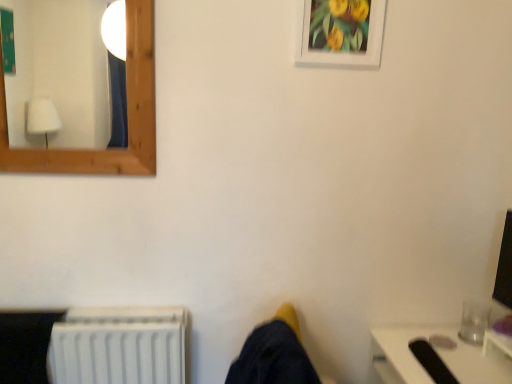
Question: From the image's perspective, is white matte picture frame at upper center below wooden frame mirror at upper left?

Choices:
 (A) yes
 (B) no

Answer: (B)

Question: Is white matte picture frame at upper center positioned with its back to wooden frame mirror at upper left?

Choices:
 (A) yes
 (B) no

Answer: (B)

Question: Can you confirm if white matte picture frame at upper center is taller than wooden frame mirror at upper left?

Choices:
 (A) no
 (B) yes

Answer: (A)

Question: Are white matte picture frame at upper center and wooden frame mirror at upper left beside each other?

Choices:
 (A) no
 (B) yes

Answer: (A)

Question: Is white matte picture frame at upper center oriented towards wooden frame mirror at upper left?

Choices:
 (A) yes
 (B) no

Answer: (B)

Question: Based on their sizes in the image, would you say white plastic radiator at lower left is bigger or smaller than wooden frame mirror at upper left?

Choices:
 (A) small
 (B) big

Answer: (B)

Question: In terms of width, does white plastic radiator at lower left look wider or thinner when compared to wooden frame mirror at upper left?

Choices:
 (A) thin
 (B) wide

Answer: (B)

Question: Considering the positions of point (115, 379) and point (54, 100), is point (115, 379) closer or farther from the camera than point (54, 100)?

Choices:
 (A) closer
 (B) farther

Answer: (A)

Question: From the image's perspective, is white plastic radiator at lower left positioned above or below wooden frame mirror at upper left?

Choices:
 (A) below
 (B) above

Answer: (A)

Question: Considering the positions of white matte picture frame at upper center and wooden frame mirror at upper left in the image, is white matte picture frame at upper center bigger or smaller than wooden frame mirror at upper left?

Choices:
 (A) big
 (B) small

Answer: (B)

Question: In terms of height, does white matte picture frame at upper center look taller or shorter compared to wooden frame mirror at upper left?

Choices:
 (A) tall
 (B) short

Answer: (B)

Question: From the image's perspective, is white matte picture frame at upper center above or below wooden frame mirror at upper left?

Choices:
 (A) below
 (B) above

Answer: (B)

Question: Is white matte picture frame at upper center in front of or behind wooden frame mirror at upper left in the image?

Choices:
 (A) behind
 (B) front

Answer: (A)

Question: Is point (328, 14) closer or farther from the camera than point (180, 322)?

Choices:
 (A) farther
 (B) closer

Answer: (B)

Question: Which is correct: white matte picture frame at upper center is inside white plastic radiator at lower left, or outside of it?

Choices:
 (A) inside
 (B) outside

Answer: (B)